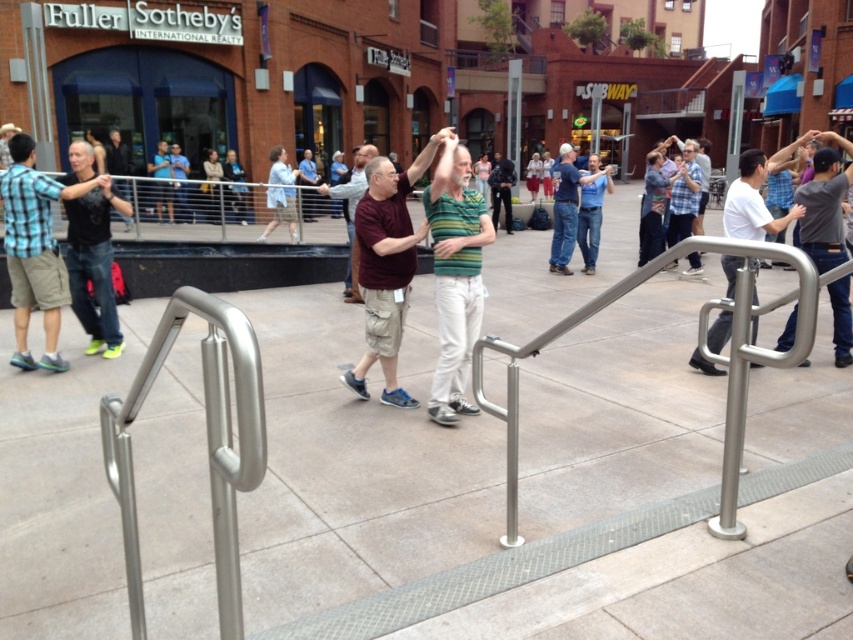
How much distance is there between white matte shirt at right and maroon shirt at center?

They are 4.44 meters apart.

Is point (733, 282) positioned after point (352, 296)?

No, it is in front of (352, 296).

Where is `white matte shirt at right`? white matte shirt at right is located at coordinates (752, 202).

Does maroon fabric shirt at center have a larger size compared to black matte shirt at center?

Correct, maroon fabric shirt at center is larger in size than black matte shirt at center.

Is maroon fabric shirt at center closer to camera compared to black matte shirt at center?

Yes, it is.

Consider the image. Measure the distance between maroon fabric shirt at center and camera.

maroon fabric shirt at center and camera are 4.81 meters apart.

This screenshot has width=853, height=640. Find the location of `maroon fabric shirt at center`. maroon fabric shirt at center is located at coordinates (387, 266).

Who is lower down, green striped shirt at center or white matte shirt at right?

Positioned lower is green striped shirt at center.

Does green striped shirt at center appear under white matte shirt at right?

Yes.

Is point (456, 179) farther from camera compared to point (759, 196)?

No, (456, 179) is closer to viewer.

The height and width of the screenshot is (640, 853). What are the coordinates of `green striped shirt at center` in the screenshot? It's located at [x=456, y=275].